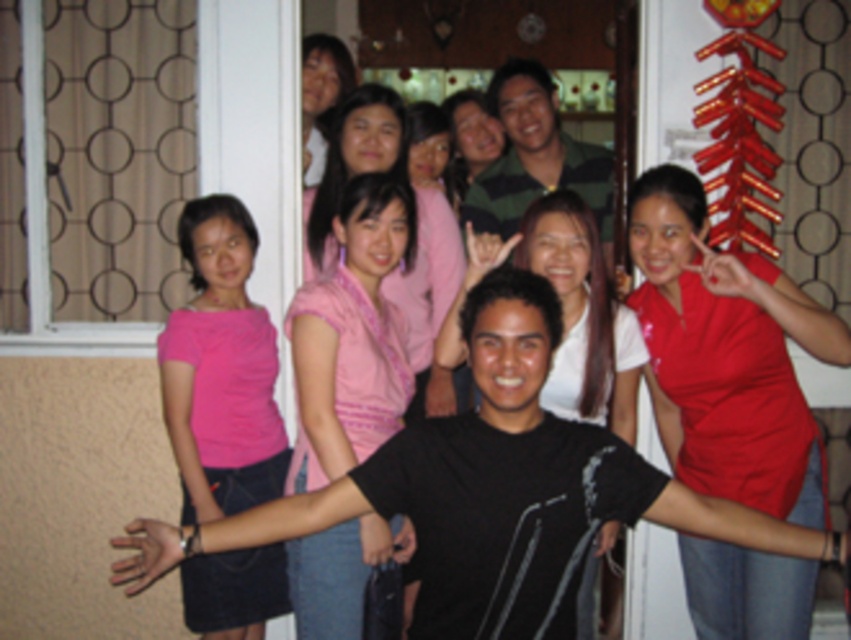
Question: Which of these objects is positioned closest to the pink fabric shirt at upper center?

Choices:
 (A) black matte shirt at center
 (B) striped cotton shirt at center
 (C) red matte shirt at right

Answer: (B)

Question: Which point appears closest to the camera in this image?

Choices:
 (A) (287, 499)
 (B) (638, 364)

Answer: (A)

Question: Observing the image, what is the correct spatial positioning of red matte shirt at right in reference to black matte shirt at center?

Choices:
 (A) right
 (B) left

Answer: (A)

Question: Is black matte shirt at center positioned behind striped cotton shirt at center?

Choices:
 (A) yes
 (B) no

Answer: (B)

Question: Which object is closer to the camera taking this photo?

Choices:
 (A) striped cotton shirt at center
 (B) pink matte shirt at left

Answer: (B)

Question: Considering the relative positions of red matte shirt at right and pink matte shirt at left in the image provided, where is red matte shirt at right located with respect to pink matte shirt at left?

Choices:
 (A) below
 (B) above

Answer: (B)